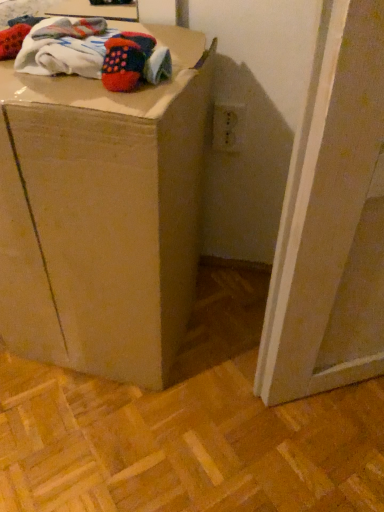
Question: Is brown cardboard box at center next to knitted wool socks at upper left and touching it?

Choices:
 (A) no
 (B) yes

Answer: (A)

Question: From a real-world perspective, is brown cardboard box at center positioned over knitted wool socks at upper left based on gravity?

Choices:
 (A) yes
 (B) no

Answer: (B)

Question: Is brown cardboard box at center to the right of knitted wool socks at upper left from the viewer's perspective?

Choices:
 (A) yes
 (B) no

Answer: (B)

Question: Can you confirm if brown cardboard box at center is smaller than knitted wool socks at upper left?

Choices:
 (A) yes
 (B) no

Answer: (B)

Question: From the image's perspective, does brown cardboard box at center appear higher than knitted wool socks at upper left?

Choices:
 (A) yes
 (B) no

Answer: (B)

Question: Does brown cardboard box at center have a lesser height compared to knitted wool socks at upper left?

Choices:
 (A) yes
 (B) no

Answer: (B)

Question: Can you confirm if knitted wool socks at upper left is bigger than brown cardboard box at center?

Choices:
 (A) yes
 (B) no

Answer: (B)

Question: Is knitted wool socks at upper left taller than brown cardboard box at center?

Choices:
 (A) no
 (B) yes

Answer: (A)

Question: From a real-world perspective, is knitted wool socks at upper left below brown cardboard box at center?

Choices:
 (A) yes
 (B) no

Answer: (B)

Question: Does knitted wool socks at upper left touch brown cardboard box at center?

Choices:
 (A) no
 (B) yes

Answer: (A)

Question: Is knitted wool socks at upper left wider than brown cardboard box at center?

Choices:
 (A) yes
 (B) no

Answer: (B)

Question: Does knitted wool socks at upper left appear on the right side of brown cardboard box at center?

Choices:
 (A) no
 (B) yes

Answer: (B)

Question: Is brown cardboard box at center in front of or behind knitted wool socks at upper left in the image?

Choices:
 (A) behind
 (B) front

Answer: (B)